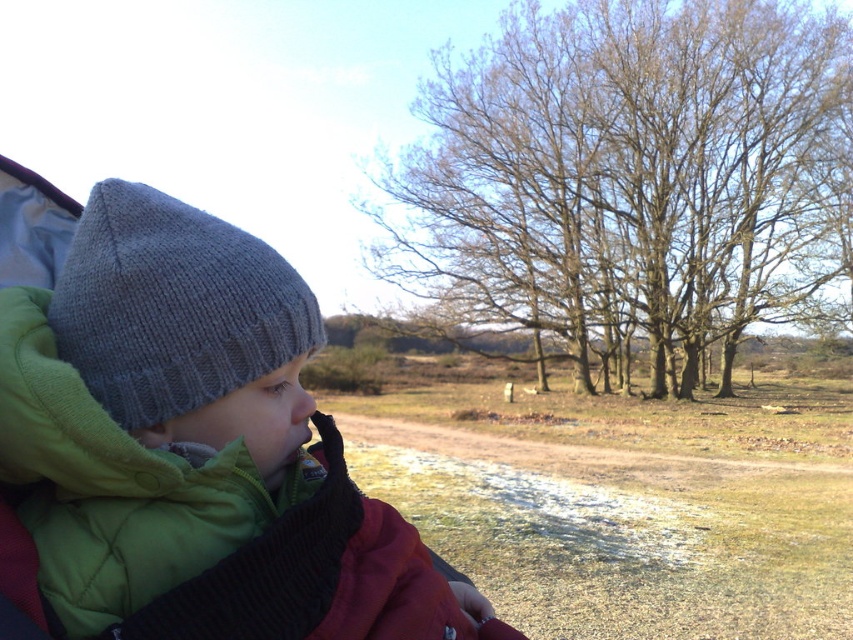
Question: Which point is closer to the camera taking this photo?

Choices:
 (A) (624, 138)
 (B) (76, 353)
 (C) (28, 504)

Answer: (B)

Question: Is knitted woolen hat at upper left thinner than gray knitted hat at left?

Choices:
 (A) yes
 (B) no

Answer: (B)

Question: Which object is positioned closest to the gray knitted hat at left?

Choices:
 (A) bare branches at upper center
 (B) knitted woolen hat at upper left

Answer: (B)

Question: In this image, where is knitted woolen hat at upper left located relative to bare branches at upper center?

Choices:
 (A) above
 (B) below

Answer: (B)

Question: Is knitted woolen hat at upper left in front of gray knitted hat at left?

Choices:
 (A) yes
 (B) no

Answer: (A)

Question: Estimate the real-world distances between objects in this image. Which object is farther from the gray knitted hat at left?

Choices:
 (A) bare branches at upper center
 (B) knitted woolen hat at upper left

Answer: (A)